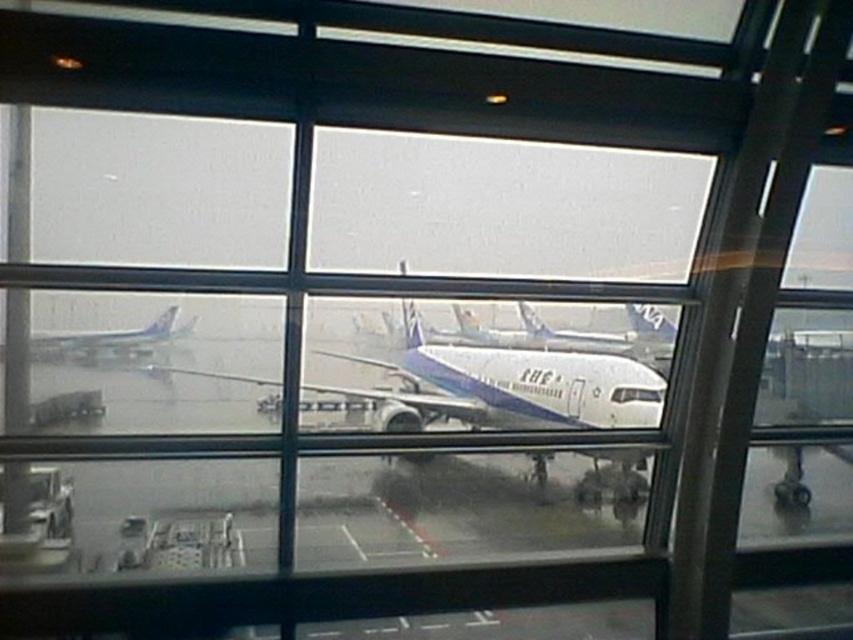
You are standing inside an airport terminal and looking through a large window at the airplanes outside. There is a specific point marked at coordinates point (529, 360). If you want to take a photo of this point with a camera that has a maximum focus range of 30 feet, will the camera be able to focus on it?

The distance between point (529, 360) and the camera is 29.33 feet, which is within the camera maximum focus range of 30 feet. Therefore, the camera can focus on the point.

Looking at this image, you are standing in the airport terminal and see the white glossy airplane at center through the window. If you were to draw a straight line from your eye level to the airplane, what coordinates would it land on?

The straight line from your eye level would land at the coordinates point (506,380) where the white glossy airplane at center is located.

You are an airport maintenance worker needing to inspect both the white glossy airplane at center and the white glossy airplane at left. Since you can only inspect one at a time, which airplane should you inspect first based on their positions relative to the window?

You should inspect the white glossy airplane at center first because it is closer to the window than the white glossy airplane at left, which is further away and obscured by the center airplane.